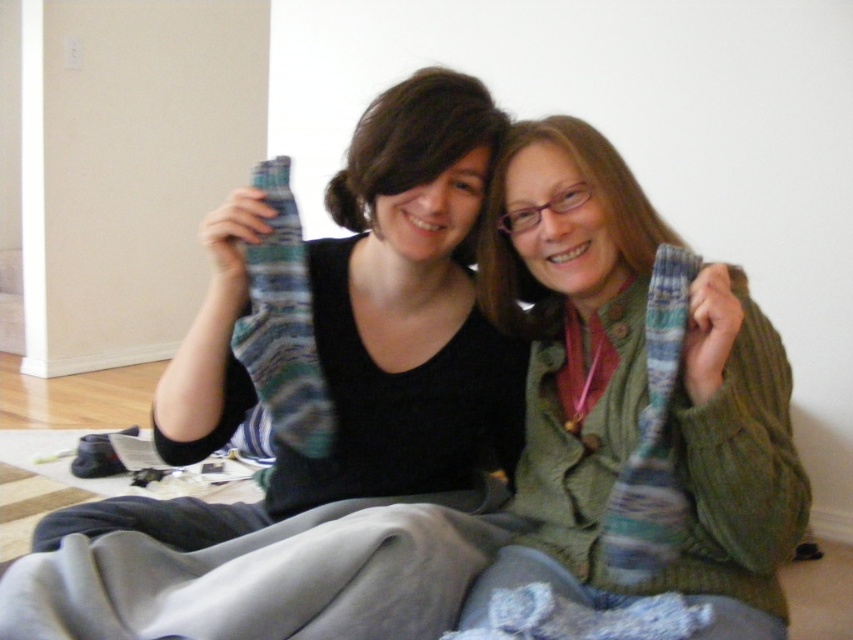
You are a tailor who needs to determine which item is taller between the striped wool sock at upper center and the knitted wool scarf at right. Based on the scene, which one is taller?

The striped wool sock at upper center is taller than the knitted wool scarf at right according to the description.

You are standing in the living room and want to place a small plant between the two points marked as point (381, 433) and point (672, 531). Which point should the plant be closer to in order to be closer to the viewer?

The plant should be placed closer to point (381, 433) because it is closer to the viewer compared to point (672, 531).

You are taking a photo of two people holding striped socks in a living room. You notice two points in the image at coordinates point (x=779, y=522) and point (x=273, y=173). Which point is nearer to the camera?

Point (x=779, y=522) is closer to the camera than point (x=273, y=173).